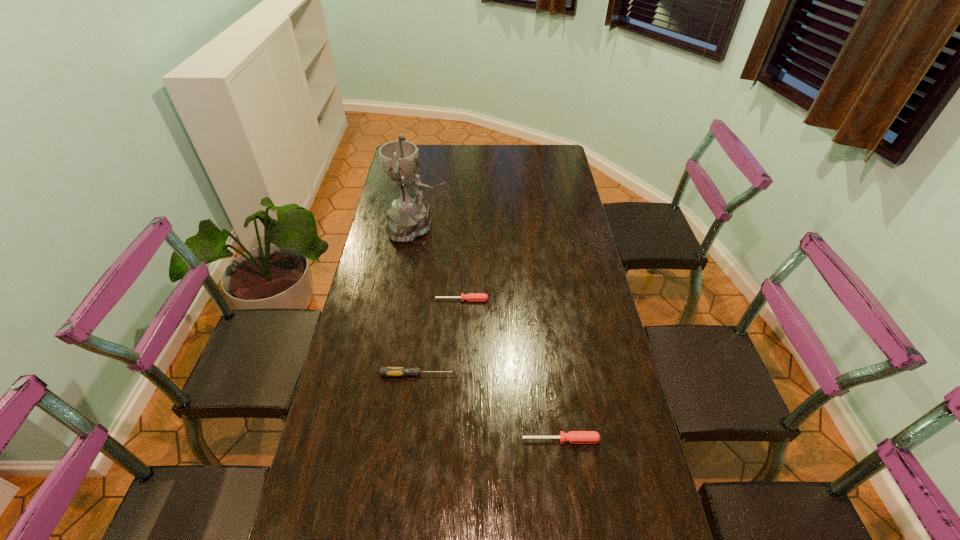
Where is `the tallest object`? The width and height of the screenshot is (960, 540). the tallest object is located at coordinates (407, 219).

This screenshot has height=540, width=960. What are the coordinates of `award` in the screenshot? It's located at (407, 219).

The height and width of the screenshot is (540, 960). I want to click on the second farthest screwdriver, so click(384, 371).

At what (x,y) coordinates should I click in order to perform the action: click on the rightmost screwdriver. Please return your answer as a coordinate pair (x, y). This screenshot has height=540, width=960. Looking at the image, I should click on point(574,437).

Find the location of `the nearest object`. the nearest object is located at coordinates (574, 437).

Identify the location of the second farthest object. (470, 296).

Identify the location of vacant area situated 0.310m on the side with emblem of the tallest object. (527, 228).

Locate an element on the screen. free point located 0.170m insert the second nearest screwdriver into a screw head is located at coordinates (512, 375).

The image size is (960, 540). What are the coordinates of `vacant space situated 0.160m on the back of the nearest screwdriver` in the screenshot? It's located at tap(553, 382).

Locate an element on the screen. The height and width of the screenshot is (540, 960). vacant region located on the back of the farthest screwdriver is located at coordinates pos(463,271).